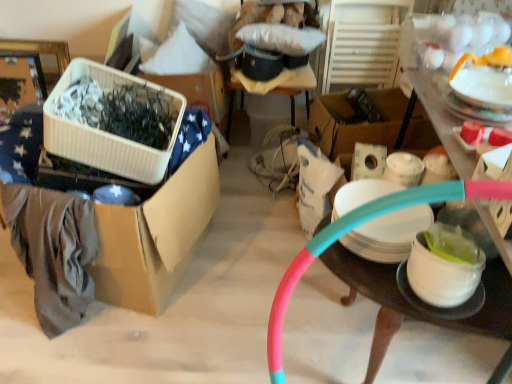
Question: Which direction should I rotate to look at white plastic storage box at upper center, arranged as the second storage box when viewed from the right?

Choices:
 (A) right
 (B) left

Answer: (B)

Question: Can you see white glossy bowl at lower right, placed as the third tableware when sorted from top to bottom, touching white ribbed plastic container at left, the second storage box viewed from the left?

Choices:
 (A) yes
 (B) no

Answer: (B)

Question: From a real-world perspective, is white glossy bowl at lower right, placed as the second tableware when sorted from left to right, under white ribbed plastic container at left, the second storage box viewed from the left?

Choices:
 (A) yes
 (B) no

Answer: (A)

Question: Is white ribbed plastic container at left, the second storage box viewed from the left, completely or partially inside white glossy bowl at lower right, which is the 1th tableware from bottom to top?

Choices:
 (A) no
 (B) yes

Answer: (A)

Question: From the image's perspective, is white glossy bowl at lower right, placed as the second tableware when sorted from left to right, over white ribbed plastic container at left, which is the third storage box in right-to-left order?

Choices:
 (A) no
 (B) yes

Answer: (A)

Question: Can you confirm if white glossy bowl at lower right, which is the 1th tableware from bottom to top, is shorter than white ribbed plastic container at left, which is the third storage box in right-to-left order?

Choices:
 (A) yes
 (B) no

Answer: (A)

Question: Is white glossy bowl at lower right, placed as the second tableware when sorted from left to right, wider than white ribbed plastic container at left, the second storage box viewed from the left?

Choices:
 (A) yes
 (B) no

Answer: (B)

Question: From a real-world perspective, is cardboard box at left, arranged as the first storage box when viewed from the left, beneath white plastic storage box at upper center, which is the 3th storage box from left to right?

Choices:
 (A) no
 (B) yes

Answer: (B)

Question: Can you confirm if cardboard box at left, arranged as the first storage box when viewed from the left, is taller than white plastic storage box at upper center, arranged as the second storage box when viewed from the right?

Choices:
 (A) yes
 (B) no

Answer: (A)

Question: Considering the relative positions of cardboard box at left, arranged as the first storage box when viewed from the left, and white plastic storage box at upper center, arranged as the second storage box when viewed from the right, in the image provided, is cardboard box at left, arranged as the first storage box when viewed from the left, to the right of white plastic storage box at upper center, arranged as the second storage box when viewed from the right, from the viewer's perspective?

Choices:
 (A) yes
 (B) no

Answer: (B)

Question: Can you confirm if cardboard box at left, arranged as the first storage box when viewed from the left, is smaller than white plastic storage box at upper center, which is the 3th storage box from left to right?

Choices:
 (A) no
 (B) yes

Answer: (A)

Question: Can you confirm if cardboard box at left, the fourth storage box positioned from the right, is bigger than white plastic storage box at upper center, which is the 3th storage box from left to right?

Choices:
 (A) no
 (B) yes

Answer: (B)

Question: Are cardboard box at left, arranged as the first storage box when viewed from the left, and white plastic storage box at upper center, arranged as the second storage box when viewed from the right, far apart?

Choices:
 (A) no
 (B) yes

Answer: (A)

Question: From a real-world perspective, is pink rubber hose at right located beneath pink rubber hoop at center, positioned as the 1th storage box in right-to-left order?

Choices:
 (A) yes
 (B) no

Answer: (A)